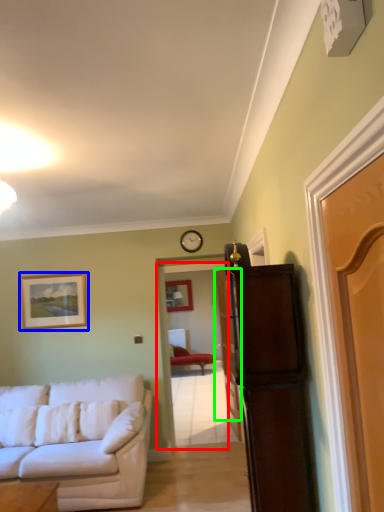
Question: Which object is positioned farthest from door (highlighted by a red box)? Select from picture frame (highlighted by a blue box) and door (highlighted by a green box).

Choices:
 (A) picture frame
 (B) door

Answer: (A)